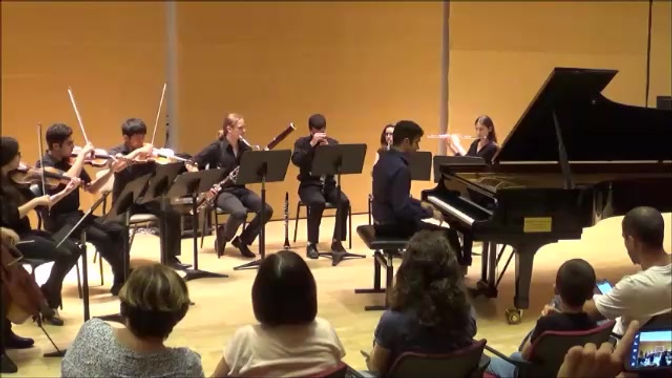
Where is `white piano key`? white piano key is located at coordinates (455, 214).